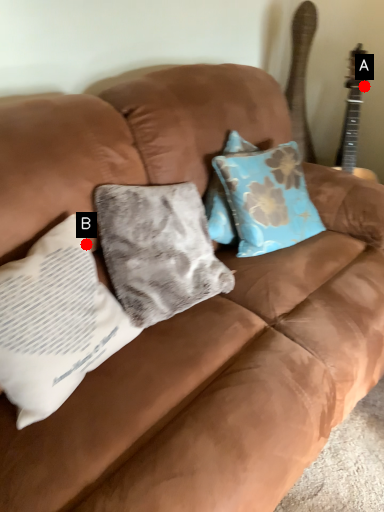
Question: Two points are circled on the image, labeled by A and B beside each circle. Which point appears closest to the camera in this image?

Choices:
 (A) A is closer
 (B) B is closer

Answer: (B)